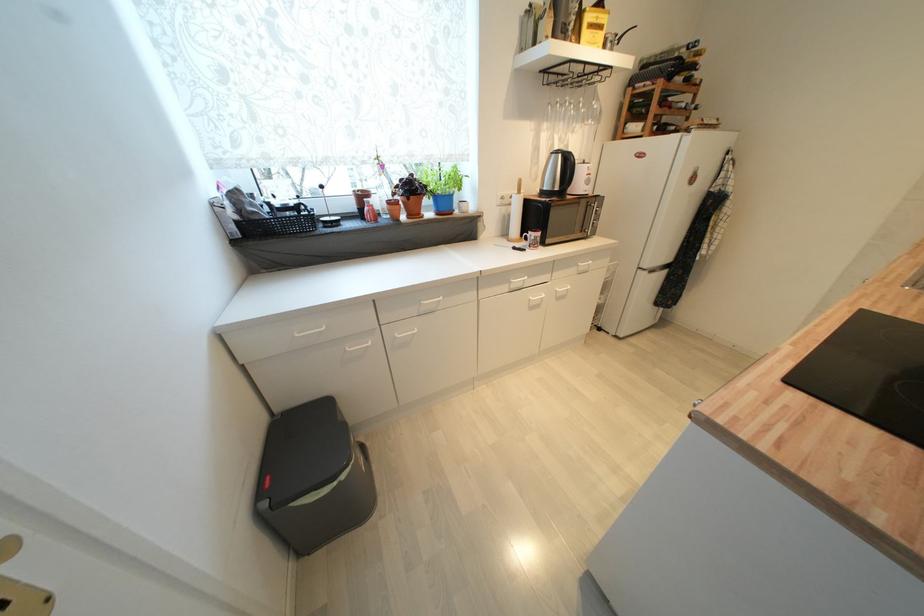
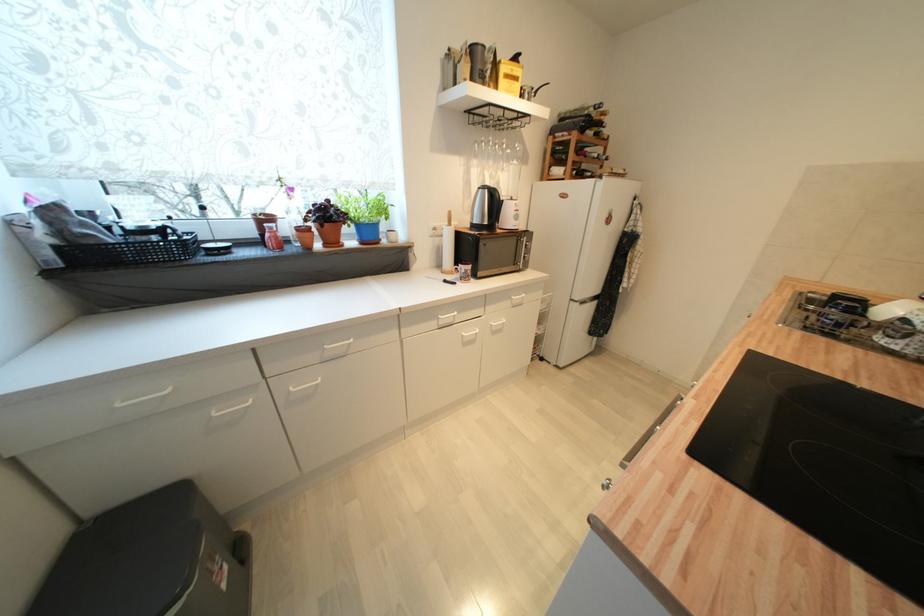
In the second image, find the point that corresponds to (x=536, y=306) in the first image.

(469, 342)